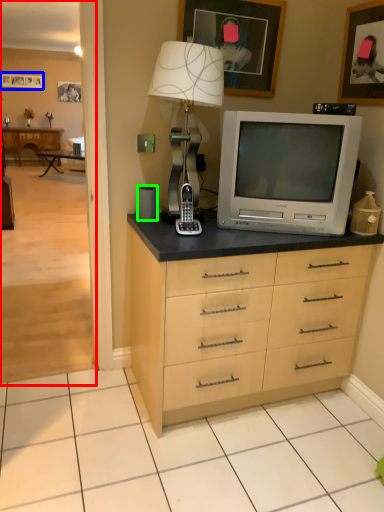
Question: Based on their relative distances, which object is farther from corridor (highlighted by a red box)? Choose from picture frame (highlighted by a blue box) and speaker (highlighted by a green box).

Choices:
 (A) picture frame
 (B) speaker

Answer: (B)